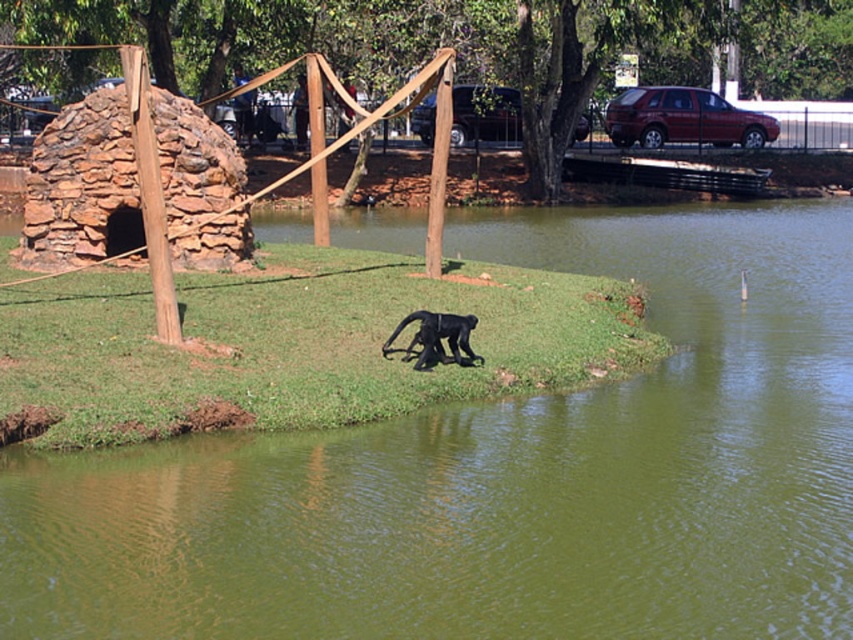
Consider the image. Can you confirm if green grass at center is positioned below dark gray fur monkey at center?

Incorrect, green grass at center is not positioned below dark gray fur monkey at center.

Is point (10, 433) closer to camera compared to point (451, 323)?

Yes, point (10, 433) is closer to viewer.

Locate an element on the screen. This screenshot has height=640, width=853. green grass at center is located at coordinates (291, 344).

Does green grassy island at center appear over dark gray fur monkey at center?

Correct, green grassy island at center is located above dark gray fur monkey at center.

Who is positioned more to the left, green grassy island at center or dark gray fur monkey at center?

From the viewer's perspective, dark gray fur monkey at center appears more on the left side.

What do you see at coordinates (503, 476) in the screenshot?
I see `green grassy island at center` at bounding box center [503, 476].

Image resolution: width=853 pixels, height=640 pixels. What are the coordinates of `green grassy island at center` in the screenshot? It's located at (503, 476).

Who is more forward, (x=590, y=486) or (x=83, y=372)?

Point (x=590, y=486)

Does green grassy island at center have a greater width compared to green grass at center?

Correct, the width of green grassy island at center exceeds that of green grass at center.

Identify the location of green grassy island at center. (503, 476).